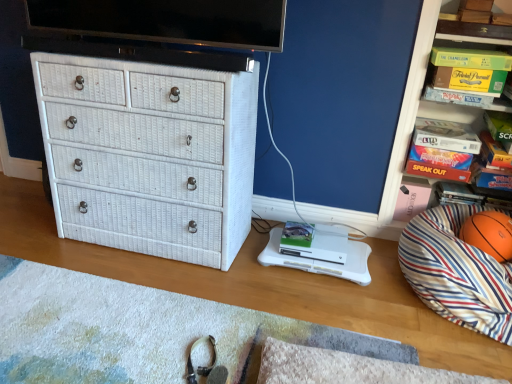
Question: Should I look upward or downward to see white wicker chest of drawers at left?

Choices:
 (A) down
 (B) up

Answer: (B)

Question: Could you tell me if orange matte basketball at right is turned towards white wicker chest of drawers at left?

Choices:
 (A) yes
 (B) no

Answer: (B)

Question: Is orange matte basketball at right not near white wicker chest of drawers at left?

Choices:
 (A) no
 (B) yes

Answer: (B)

Question: Is orange matte basketball at right further to camera compared to white wicker chest of drawers at left?

Choices:
 (A) no
 (B) yes

Answer: (B)

Question: Can you confirm if orange matte basketball at right is smaller than white wicker chest of drawers at left?

Choices:
 (A) yes
 (B) no

Answer: (A)

Question: Is orange matte basketball at right bigger than white wicker chest of drawers at left?

Choices:
 (A) yes
 (B) no

Answer: (B)

Question: Is orange matte basketball at right oriented away from white wicker chest of drawers at left?

Choices:
 (A) no
 (B) yes

Answer: (A)

Question: Does black glossy flat-screen tv at upper center have a greater width compared to green cardboard box at upper right?

Choices:
 (A) yes
 (B) no

Answer: (B)

Question: From a real-world perspective, does black glossy flat-screen tv at upper center sit lower than green cardboard box at upper right?

Choices:
 (A) no
 (B) yes

Answer: (A)

Question: From the image's perspective, is black glossy flat-screen tv at upper center beneath green cardboard box at upper right?

Choices:
 (A) yes
 (B) no

Answer: (B)

Question: From a real-world perspective, does black glossy flat-screen tv at upper center stand above green cardboard box at upper right?

Choices:
 (A) no
 (B) yes

Answer: (B)

Question: Is black glossy flat-screen tv at upper center positioned before green cardboard box at upper right?

Choices:
 (A) yes
 (B) no

Answer: (A)

Question: Does black glossy flat-screen tv at upper center have a larger size compared to green cardboard box at upper right?

Choices:
 (A) no
 (B) yes

Answer: (B)

Question: Is green cardboard game at upper right closer to camera compared to white wicker chest of drawers at left?

Choices:
 (A) no
 (B) yes

Answer: (A)